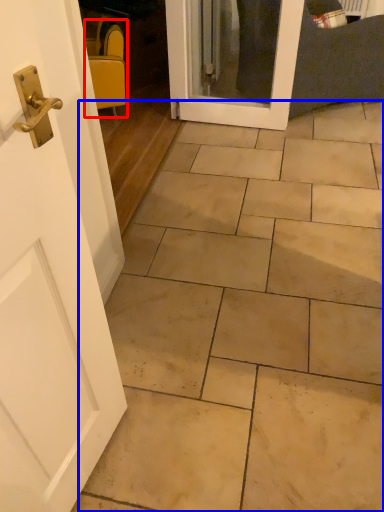
Question: Which object is further to the camera taking this photo, chair (highlighted by a red box) or ceramic tile (highlighted by a blue box)?

Choices:
 (A) chair
 (B) ceramic tile

Answer: (A)